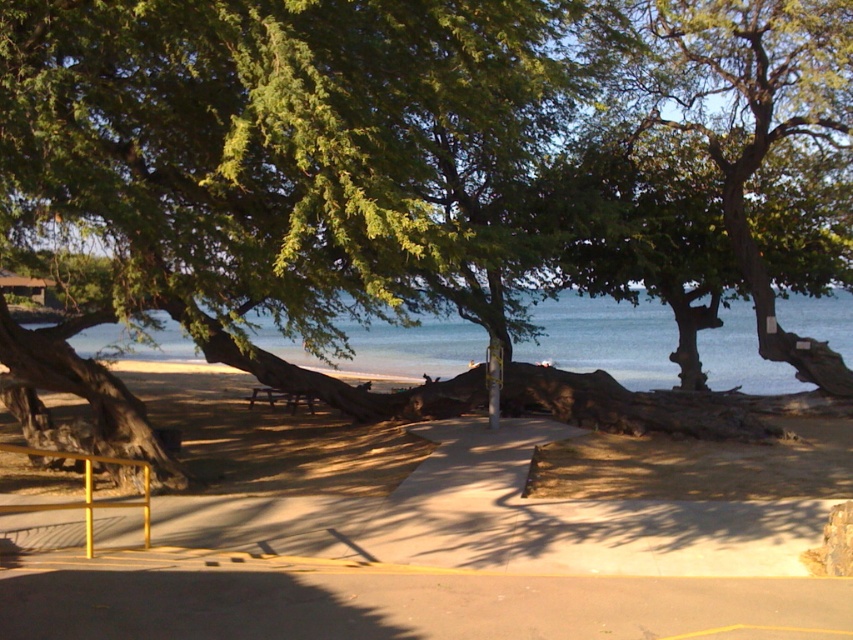
You are planning to build a small garden on the beige sand at lower center near the blue water at center. Considering their widths, which area would allow for a larger garden plot?

→ The blue water at center has a greater width than the beige sand at lower center, so the garden plot would be larger if placed there.

You are a tourist standing on the beige sand at lower center and want to reach the blue water at center. Which direction should you move to get there?

Since the beige sand at lower center is below the blue water at center, you should move upward to reach the blue water at center from the beige sand at lower center.

You are standing at a point on the path near the yellow railing. Looking towards the trees, you notice a specific coordinate marked as point (422, 538). Based on the scene, what type of terrain is located at that coordinate?

The coordinate point (422, 538) corresponds to beige sand at lower center, indicating that the terrain there is sandy.